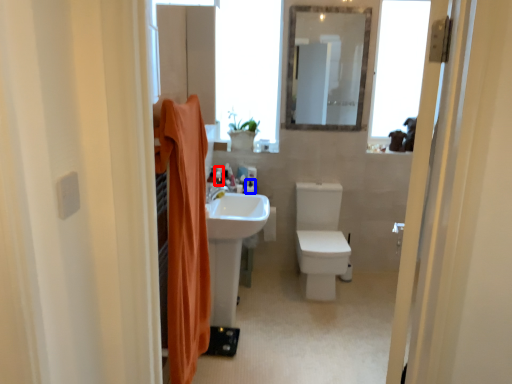
Question: Among these objects, which one is farthest to the camera, toiletry (highlighted by a red box) or toiletry (highlighted by a blue box)?

Choices:
 (A) toiletry
 (B) toiletry

Answer: (A)